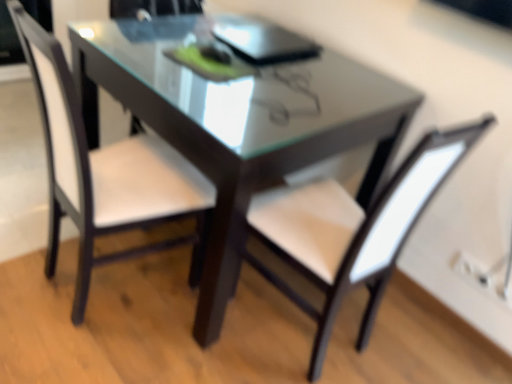
Image resolution: width=512 pixels, height=384 pixels. I want to click on free point below white leather chair at center, marked as the 1th chair in a left-to-right arrangement (from a real-world perspective), so click(x=108, y=282).